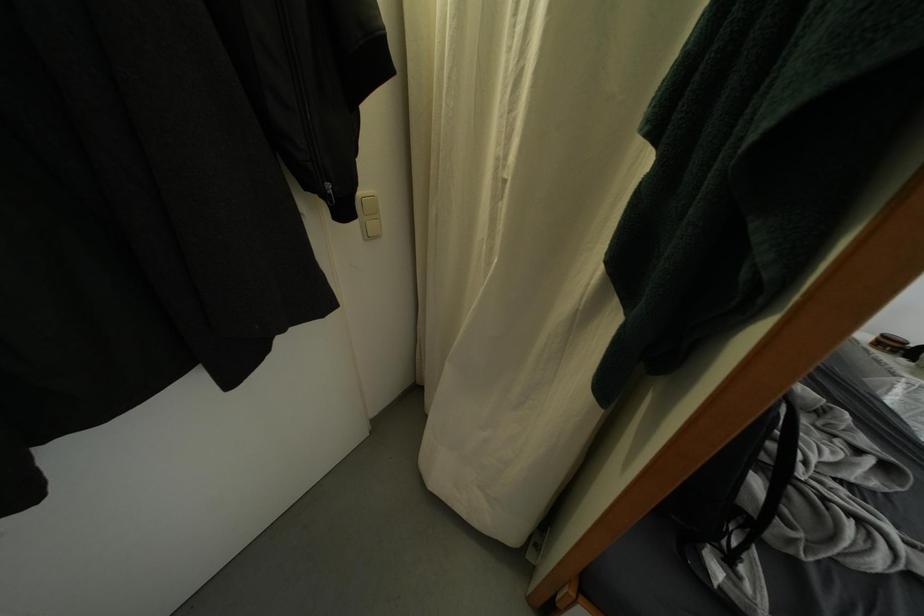
Locate an element on the screen. This screenshot has height=616, width=924. jacket zipper pull is located at coordinates (331, 193).